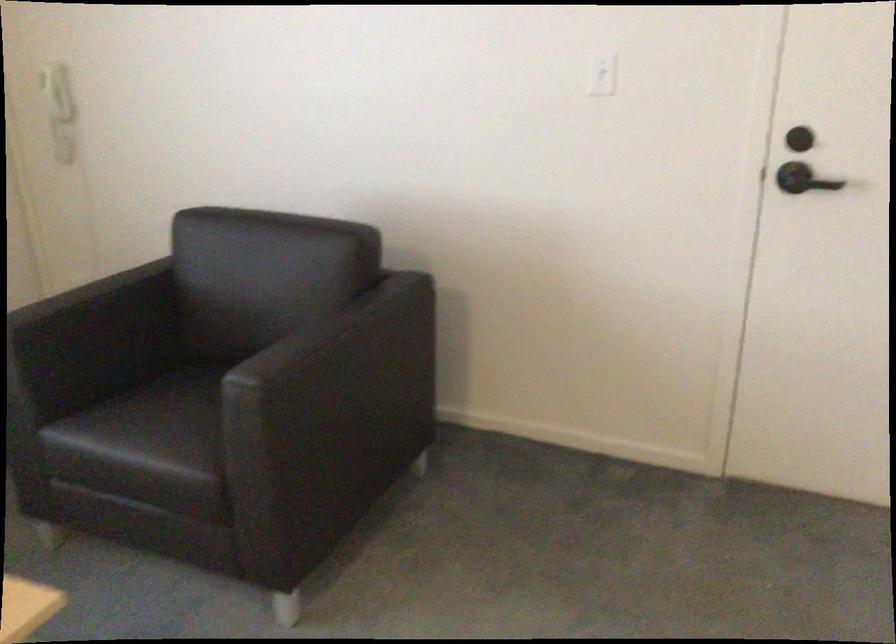
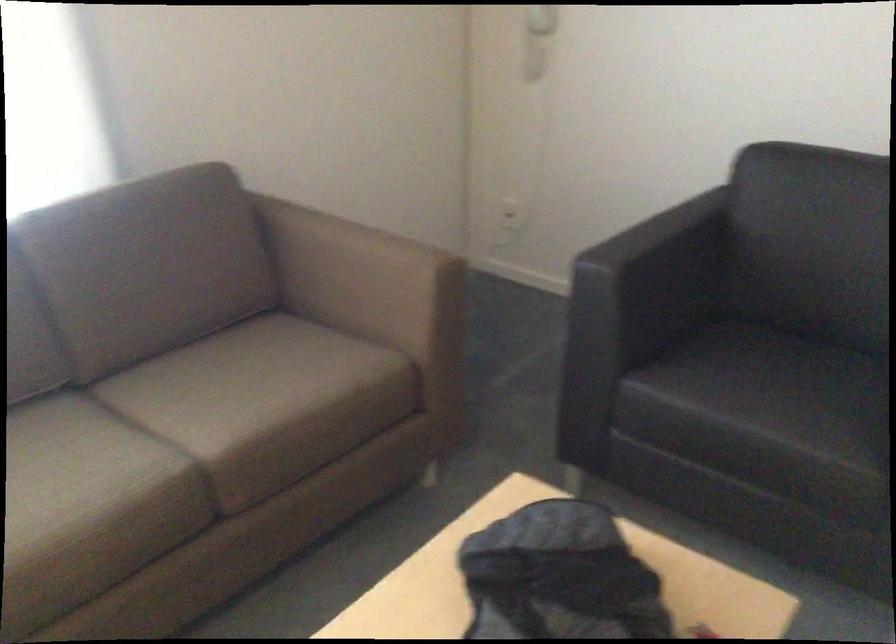
Question: In a continuous first-person perspective shot, in which direction is the camera moving?

Choices:
 (A) Left
 (B) Right
 (C) Forward
 (D) Backward

Answer: (A)